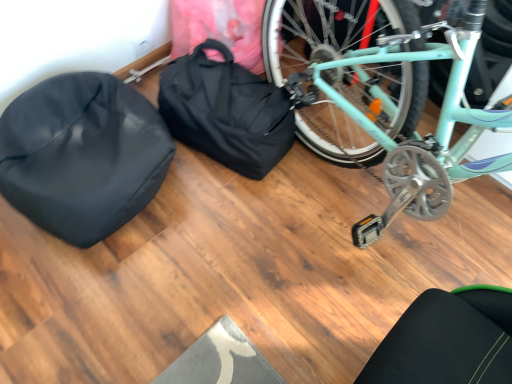
Question: From the image's perspective, is black fabric bag at center positioned above or below black matte sleeping bag at left?

Choices:
 (A) above
 (B) below

Answer: (A)

Question: Based on their sizes in the image, would you say black fabric bag at center is bigger or smaller than black matte sleeping bag at left?

Choices:
 (A) big
 (B) small

Answer: (B)

Question: From a real-world perspective, relative to black matte sleeping bag at left, is black fabric bag at center vertically above or below?

Choices:
 (A) below
 (B) above

Answer: (A)

Question: In terms of height, does black matte sleeping bag at left look taller or shorter compared to black fabric bag at center?

Choices:
 (A) tall
 (B) short

Answer: (B)

Question: Is point (158, 155) positioned closer to the camera than point (268, 153)?

Choices:
 (A) closer
 (B) farther

Answer: (A)

Question: From the image's perspective, relative to black fabric bag at center, is black matte sleeping bag at left above or below?

Choices:
 (A) below
 (B) above

Answer: (A)

Question: Is black matte sleeping bag at left inside the boundaries of black fabric bag at center, or outside?

Choices:
 (A) inside
 (B) outside

Answer: (B)